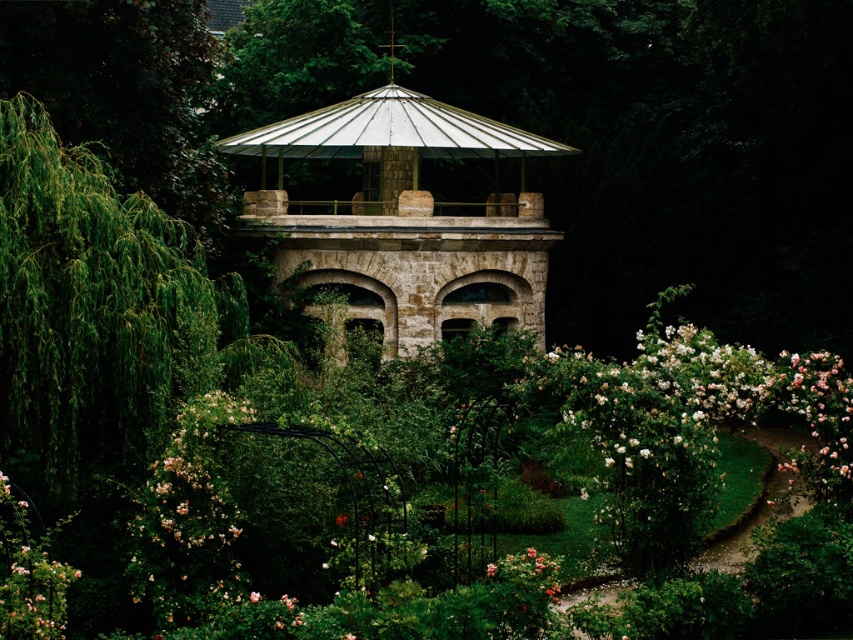
Does stone gazebo at center have a greater width compared to pink matte rose at lower center?

Yes.

Is the position of stone gazebo at center more distant than that of pink matte rose at lower center?

Yes, it is behind pink matte rose at lower center.

Does point (282, 260) come behind point (531, 570)?

Yes, it is.

In order to click on stone gazebo at center in this screenshot , I will do `click(407, 214)`.